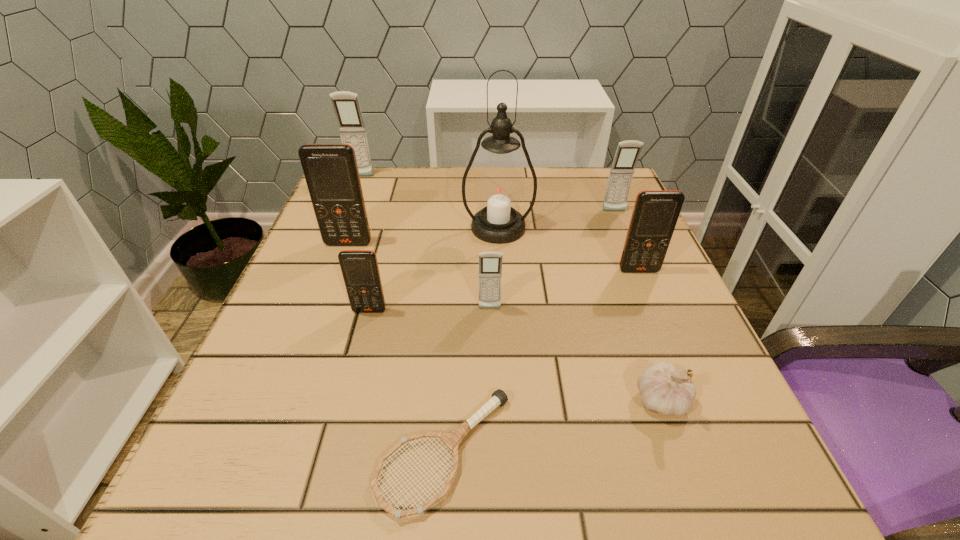
Find the location of a particular element. vacant area located on the screen of the rightmost orange cellular telephone is located at coordinates (656, 310).

Identify the location of vacant area situated 0.270m on the screen of the nearest orange cellular telephone. (330, 460).

Find the location of a particular element. The width and height of the screenshot is (960, 540). free point located 0.260m on the front-facing side of the second gray cellular telephone from right to left is located at coordinates (492, 449).

Where is `free space located 0.070m on the back of the eighth tallest object`? The image size is (960, 540). free space located 0.070m on the back of the eighth tallest object is located at coordinates (641, 342).

This screenshot has height=540, width=960. What are the coordinates of `vacant space located on the back of the shortest object` in the screenshot? It's located at pos(452,326).

Locate an element on the screen. The image size is (960, 540). oil lamp situated at the far edge is located at coordinates (499, 190).

Identify the location of object that is at the near edge. (451, 440).

At what (x,y) coordinates should I click in order to perform the action: click on garlic positioned at the right edge. Please return your answer as a coordinate pair (x, y). This screenshot has height=540, width=960. Looking at the image, I should click on (664, 390).

At what (x,y) coordinates should I click in order to perform the action: click on object at the far left corner. Please return your answer as a coordinate pair (x, y). This screenshot has height=540, width=960. Looking at the image, I should click on (346, 105).

At what (x,y) coordinates should I click in order to perform the action: click on object that is at the far right corner. Please return your answer as a coordinate pair (x, y). The height and width of the screenshot is (540, 960). Looking at the image, I should click on (627, 153).